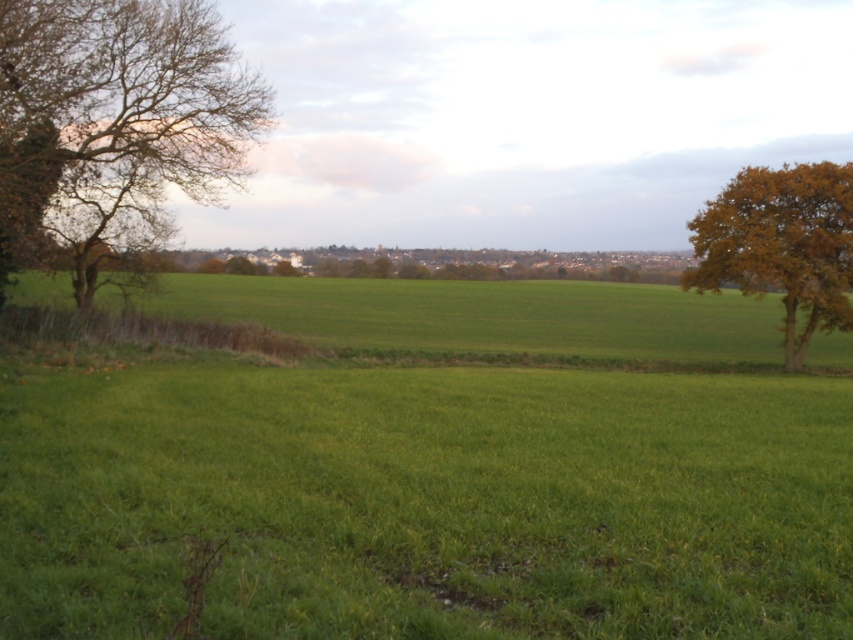
Where is `bare branches at left`? bare branches at left is located at coordinates (114, 129).

Who is more distant from viewer, (16, 52) or (830, 196)?

Positioned behind is point (830, 196).

Locate an element on the screen. bare branches at left is located at coordinates (114, 129).

Between green grassy field at center and golden-brown leafy tree at right, which one appears on the right side from the viewer's perspective?

From the viewer's perspective, golden-brown leafy tree at right appears more on the right side.

Who is lower down, green grassy field at center or golden-brown leafy tree at right?

green grassy field at center is lower down.

Is point (575, 416) farther from viewer compared to point (759, 250)?

No, it is not.

This screenshot has width=853, height=640. In order to click on green grassy field at center in this screenshot , I will do `click(428, 500)`.

Locate an element on the screen. The width and height of the screenshot is (853, 640). green grassy field at center is located at coordinates (428, 500).

Between green grassy field at center and bare branches at left, which one is positioned lower?

green grassy field at center is lower down.

Which is in front, point (772, 460) or point (260, 83)?

Point (772, 460) is in front.

Locate an element on the screen. The image size is (853, 640). green grassy field at center is located at coordinates (428, 500).